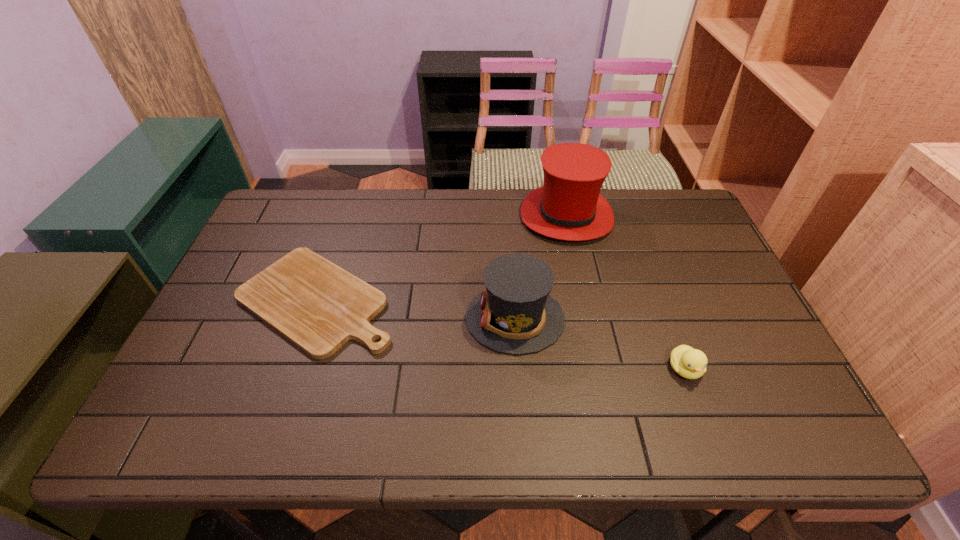
Find the location of a particular element. This screenshot has height=540, width=960. free spot that satisfies the following two spatial constraints: 1. on the back side of the farther dress hat; 2. on the right side of the chopping board is located at coordinates (346, 216).

Find the location of a particular element. The height and width of the screenshot is (540, 960). free space in the image that satisfies the following two spatial constraints: 1. on the back side of the shortest object; 2. on the left side of the taller dress hat is located at coordinates (346, 216).